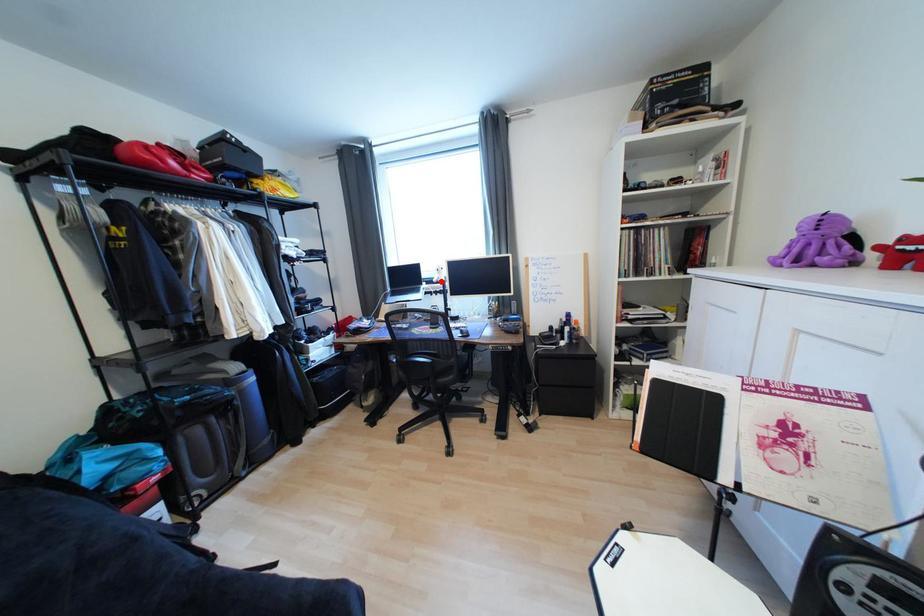
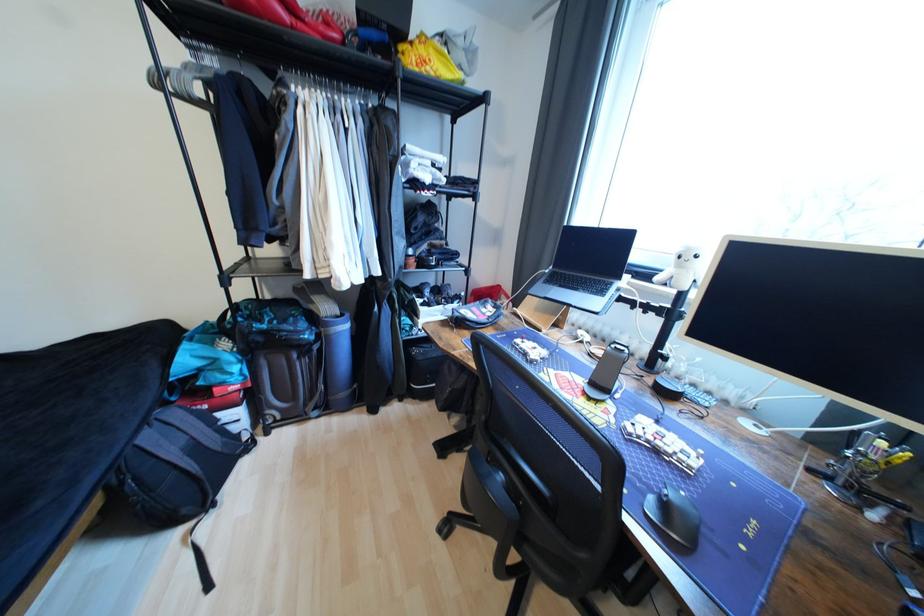
Where in the second image is the point corresponding to the highlighted location from the first image?

(663, 280)